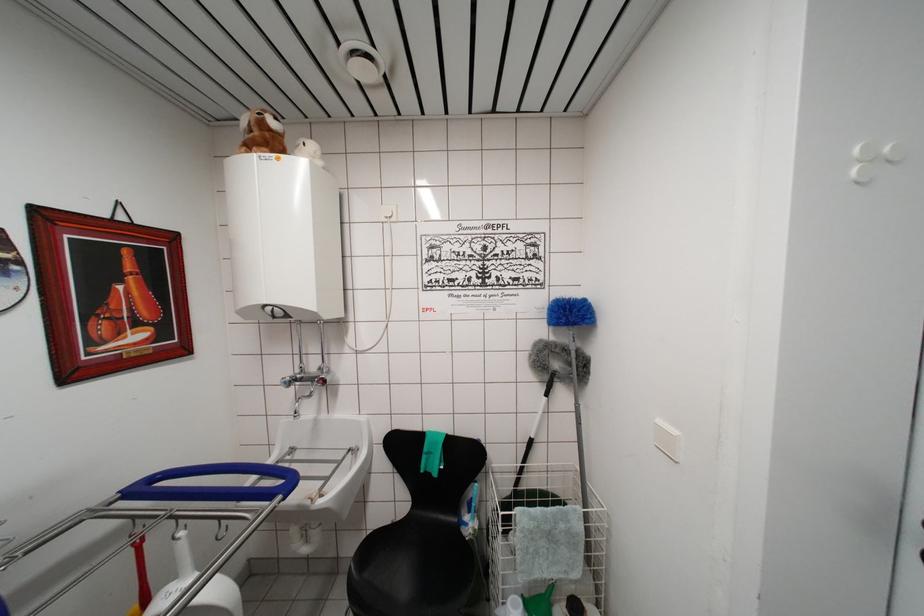
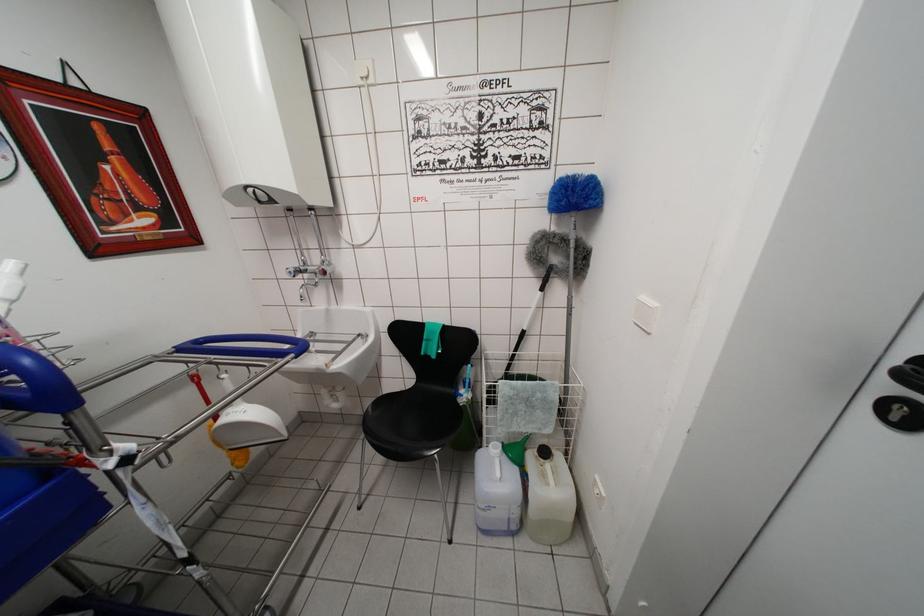
Find the pixel in the second image that matches the point at 528,466 in the first image.

(518, 354)